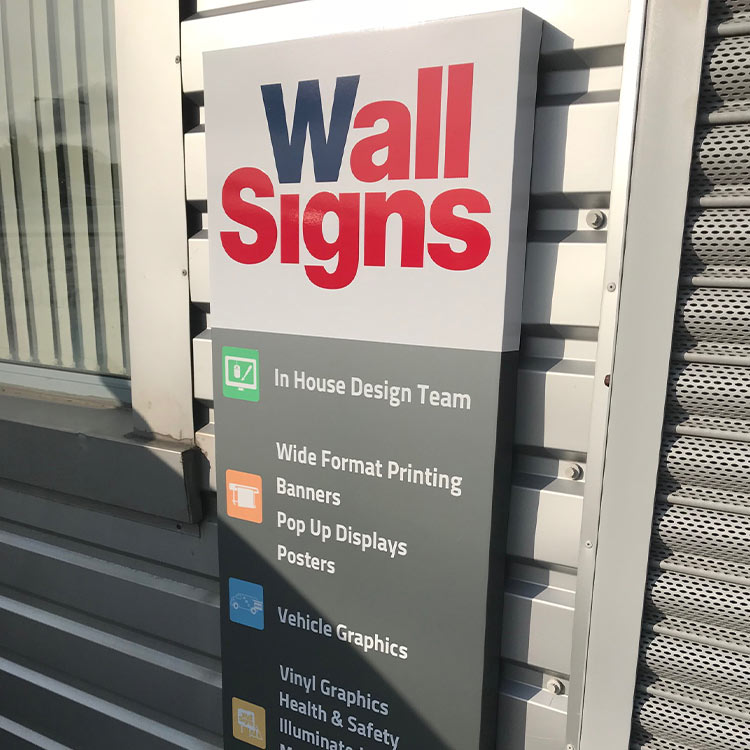
The height and width of the screenshot is (750, 750). I want to click on blinds, so click(39, 260).